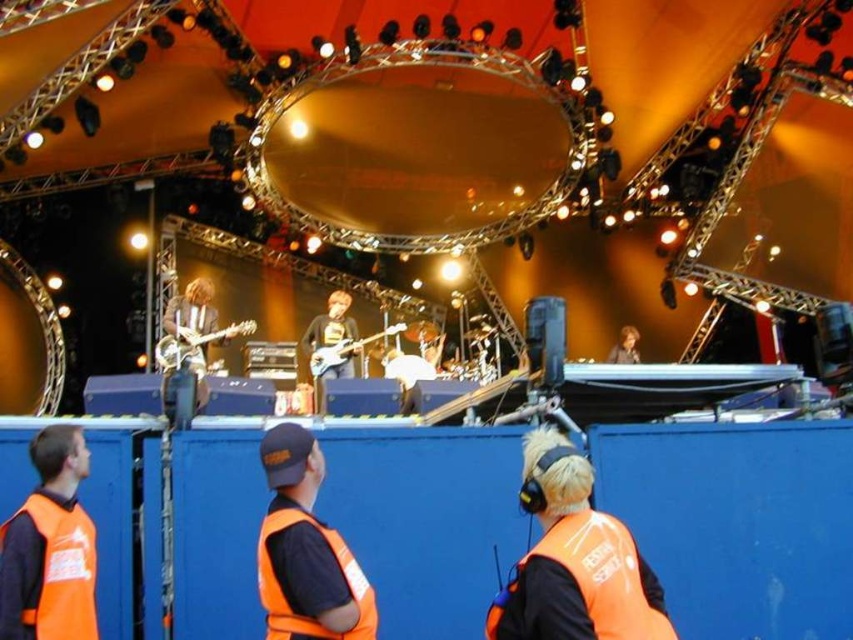
Question: Which point is closer to the camera?

Choices:
 (A) (373, 627)
 (B) (86, 600)

Answer: (B)

Question: Which object is positioned farthest from the metallic silver bass guitar at center?

Choices:
 (A) orange reflective vest at lower right
 (B) orange fabric safety vest at center
 (C) shiny metallic guitar at left
 (D) orange fabric safety vest at lower left

Answer: (B)

Question: Does orange fabric safety vest at center have a lesser width compared to shiny metallic guitar at left?

Choices:
 (A) no
 (B) yes

Answer: (B)

Question: Which of these objects is positioned farthest from the orange fabric safety vest at center?

Choices:
 (A) smooth black jacket at upper center
 (B) metallic silver bass guitar at center

Answer: (A)

Question: Does orange fabric safety vest at center come in front of shiny metallic guitar at left?

Choices:
 (A) yes
 (B) no

Answer: (A)

Question: Does orange reflective vest at lower right lie in front of smooth black jacket at upper center?

Choices:
 (A) yes
 (B) no

Answer: (A)